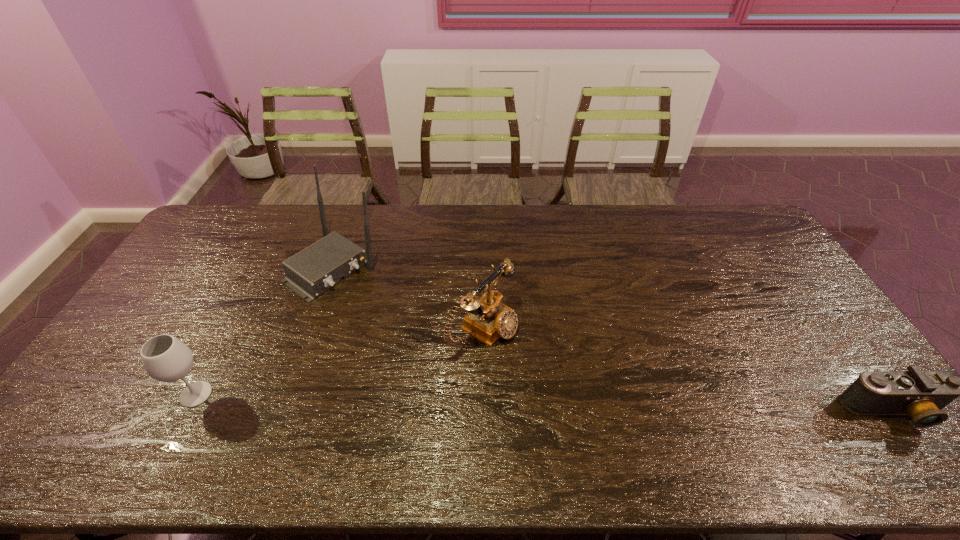
Find the location of a particular element. The image size is (960, 540). free space between the second object from right to left and the router is located at coordinates (408, 299).

This screenshot has height=540, width=960. Identify the location of free space between the router and the camera. (612, 340).

You are a GUI agent. You are given a task and a screenshot of the screen. Output one action in this format:
    pyautogui.click(x=<x>, y=<y>)
    Task: Click on the empty space that is in between the router and the leftmost object
    The width and height of the screenshot is (960, 540).
    Given the screenshot: What is the action you would take?
    pyautogui.click(x=265, y=331)

You are a GUI agent. You are given a task and a screenshot of the screen. Output one action in this format:
    pyautogui.click(x=<x>, y=<y>)
    Task: Click on the free space between the tallest object and the third object from left to right
    
    Given the screenshot: What is the action you would take?
    pyautogui.click(x=408, y=299)

Where is `object that stands as the third closest to the telephone`? object that stands as the third closest to the telephone is located at coordinates (920, 394).

Locate an element on the screen. the second closest object to the rightmost object is located at coordinates (315, 269).

This screenshot has height=540, width=960. I want to click on free space that satisfies the following two spatial constraints: 1. on the front side of the tallest object; 2. on the left side of the third object from left to right, so click(x=311, y=330).